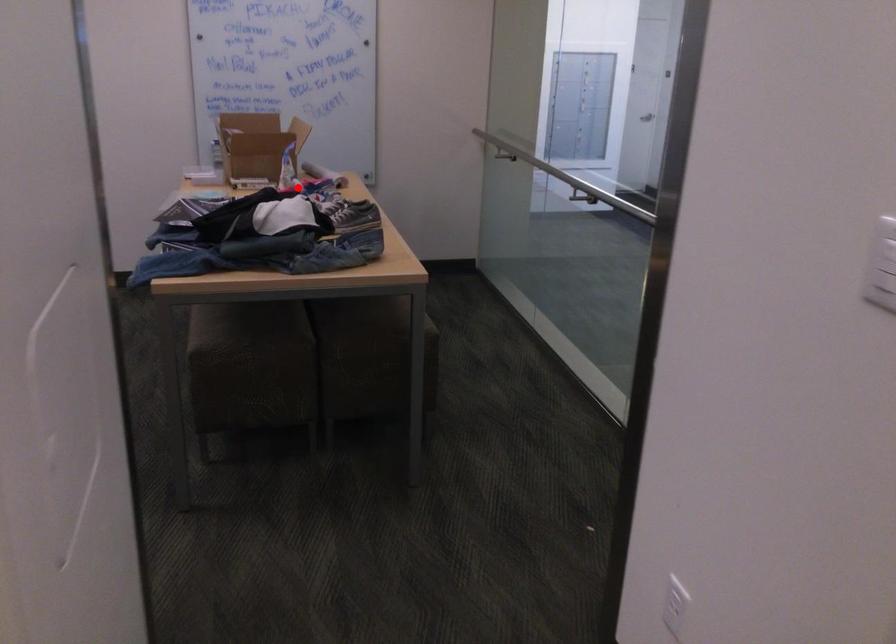
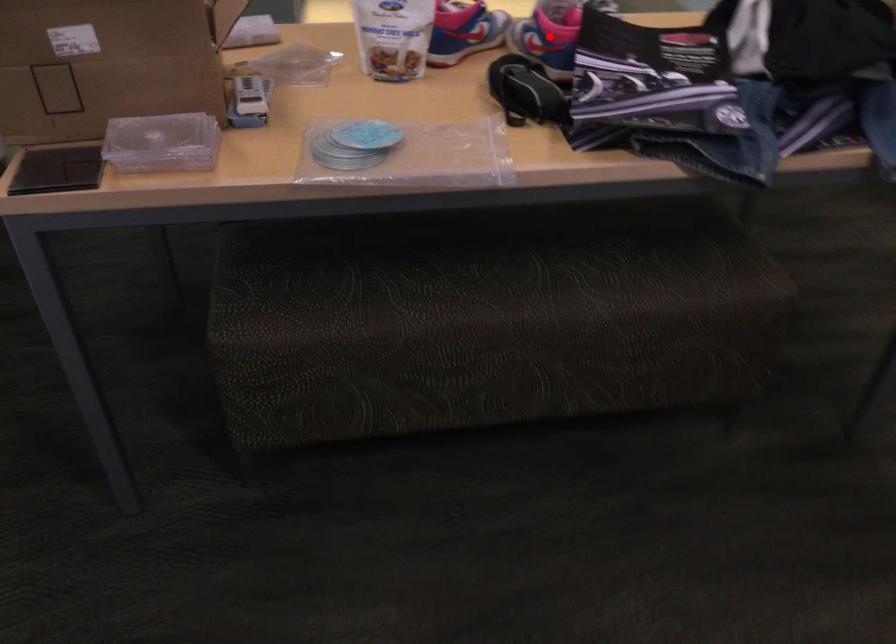
I am providing you with two images of the same scene from different viewpoints. A red point is marked on the first image and another point is marked on the second image. Are the points marked in image1 and image2 representing the same 3D position?

No